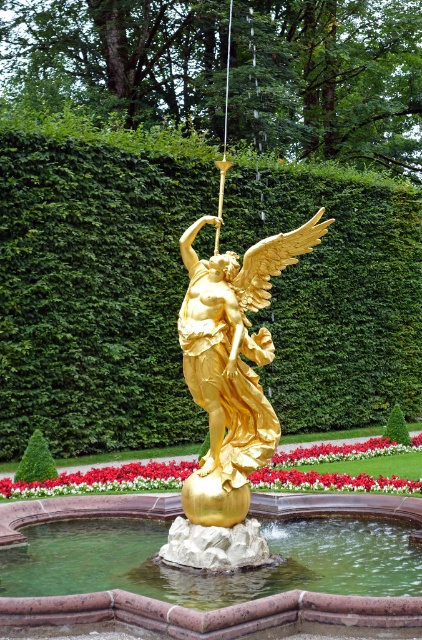
Is point (224, 515) behind point (113, 465)?

No.

Is gold polished statue at center shorter than red glossy flower at center?

No.

I want to click on gold polished statue at center, so click(x=232, y=365).

The image size is (422, 640). What are the coordinates of `gold polished statue at center` in the screenshot? It's located at (232, 365).

Between point (5, 417) and point (243, 625), which one is positioned in front?

Positioned in front is point (243, 625).

Does green leafy hedge at center appear on the right side of gold polished sphere at center?

Indeed, green leafy hedge at center is positioned on the right side of gold polished sphere at center.

Locate an element on the screen. Image resolution: width=422 pixels, height=640 pixels. green leafy hedge at center is located at coordinates (94, 291).

Is point (35, 616) farther from camera compared to point (276, 464)?

No, it is not.

Who is taller, gold polished sphere at center or red glossy flower at center?

red glossy flower at center

The height and width of the screenshot is (640, 422). I want to click on gold polished sphere at center, so click(x=213, y=612).